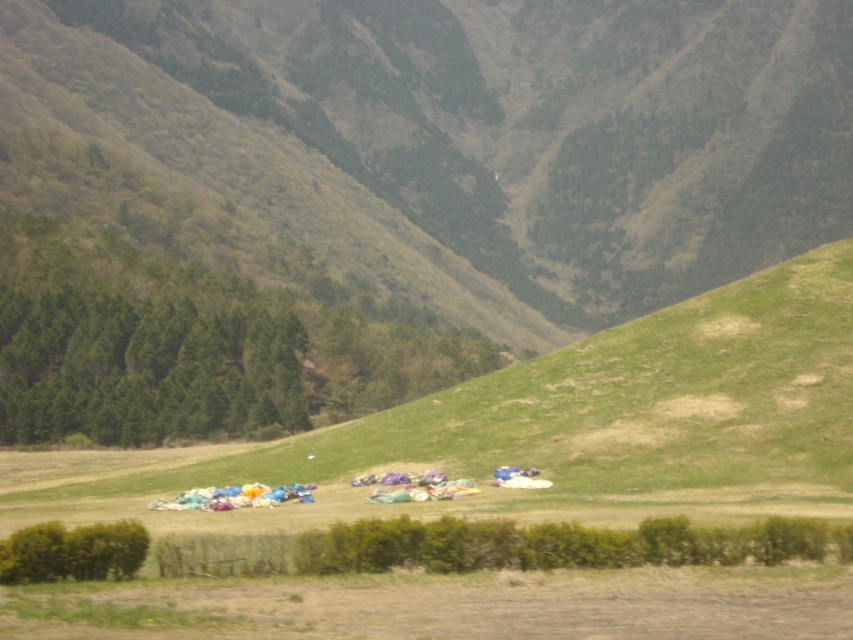
Question: Which object appears farthest from the camera in this image?

Choices:
 (A) green grassy hillside at center
 (B) multicolored fabric at center

Answer: (A)

Question: Is green grassy hillside at center smaller than green grassy field at lower center?

Choices:
 (A) no
 (B) yes

Answer: (A)

Question: In this image, where is green grassy field at lower center located relative to multicolored fabric at center?

Choices:
 (A) above
 (B) below

Answer: (A)

Question: Among these points, which one is farthest from the camera?

Choices:
 (A) (830, 378)
 (B) (47, 192)
 (C) (300, 484)

Answer: (B)

Question: Which point appears farthest from the camera in this image?

Choices:
 (A) (566, 464)
 (B) (177, 508)

Answer: (A)

Question: Does green grassy field at lower center appear on the right side of multicolored fabric at center?

Choices:
 (A) no
 (B) yes

Answer: (A)